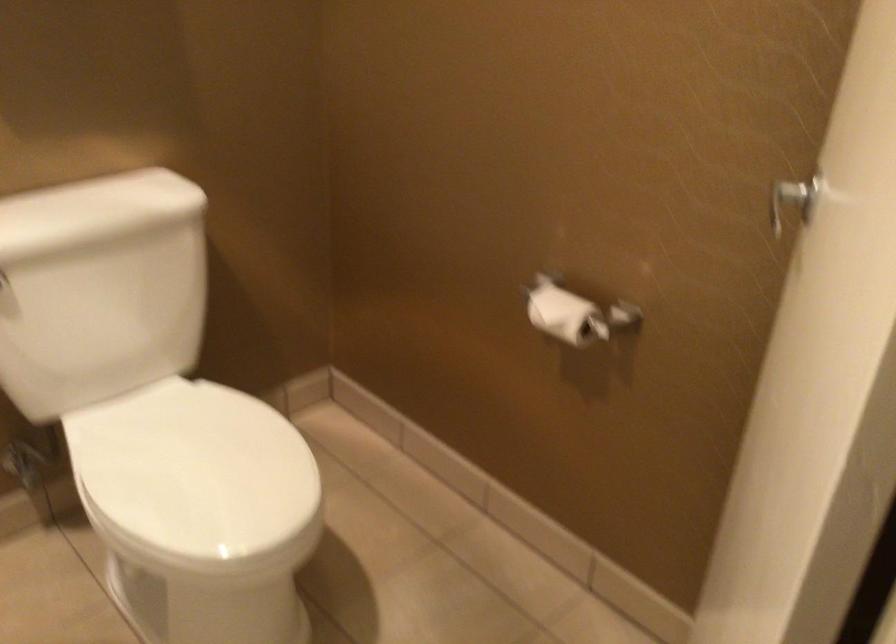
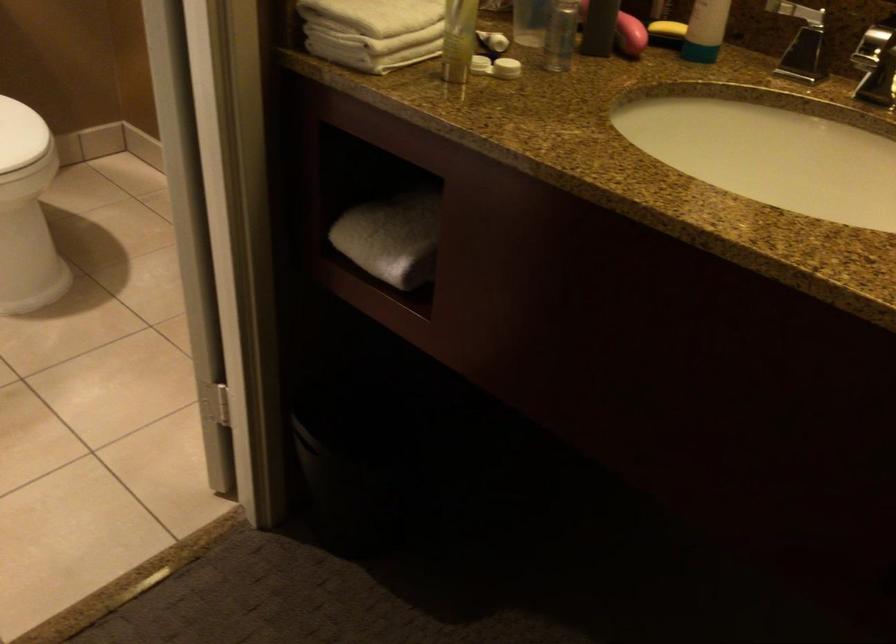
The point at (x=282, y=474) is marked in the first image. Where is the corresponding point in the second image?

(20, 135)